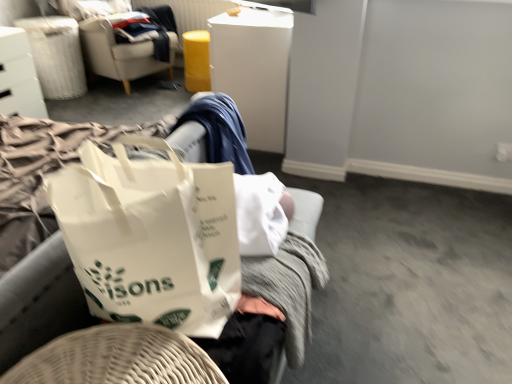
Question: In the image, is white fabric laundry basket at upper left positioned in front of or behind beige fabric chair at upper left?

Choices:
 (A) front
 (B) behind

Answer: (B)

Question: In terms of width, does white fabric laundry basket at upper left look wider or thinner when compared to beige fabric chair at upper left?

Choices:
 (A) thin
 (B) wide

Answer: (A)

Question: Which object is positioned closest to the white plastic file cabinet at upper center?

Choices:
 (A) white glossy drawer at upper left, which appears as the 1th furniture when viewed from the left
 (B) beige fabric chair at upper left
 (C) white paper bag at center, which is counted as the first furniture, starting from the right
 (D) white fabric laundry basket at upper left

Answer: (B)

Question: Based on their relative distances, which object is nearer to the white glossy drawer at upper left, which is the 1th furniture from top to bottom?

Choices:
 (A) white fabric laundry basket at upper left
 (B) white paper bag at center, which ranks as the first furniture in front-to-back order
 (C) white plastic file cabinet at upper center
 (D) beige fabric chair at upper left

Answer: (A)